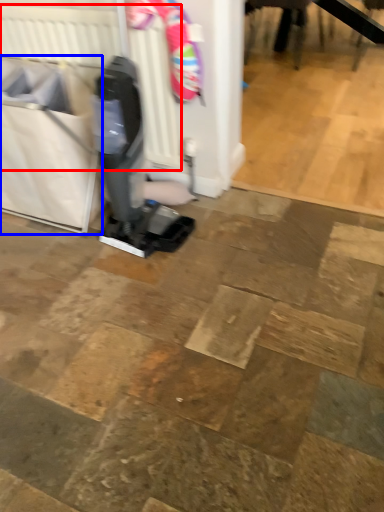
Question: Which of the following is the farthest to the observer, radiator (highlighted by a red box) or laundry basket (highlighted by a blue box)?

Choices:
 (A) radiator
 (B) laundry basket

Answer: (A)